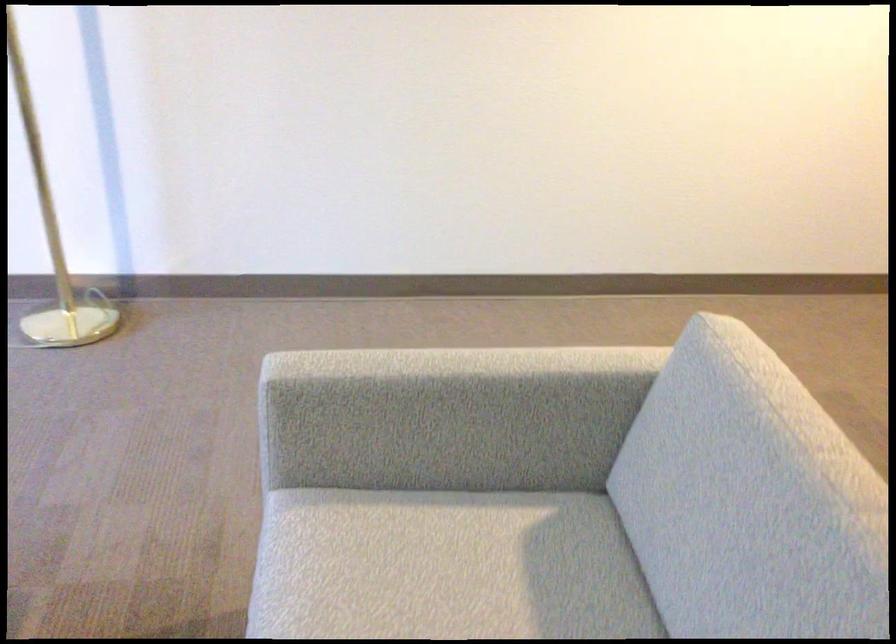
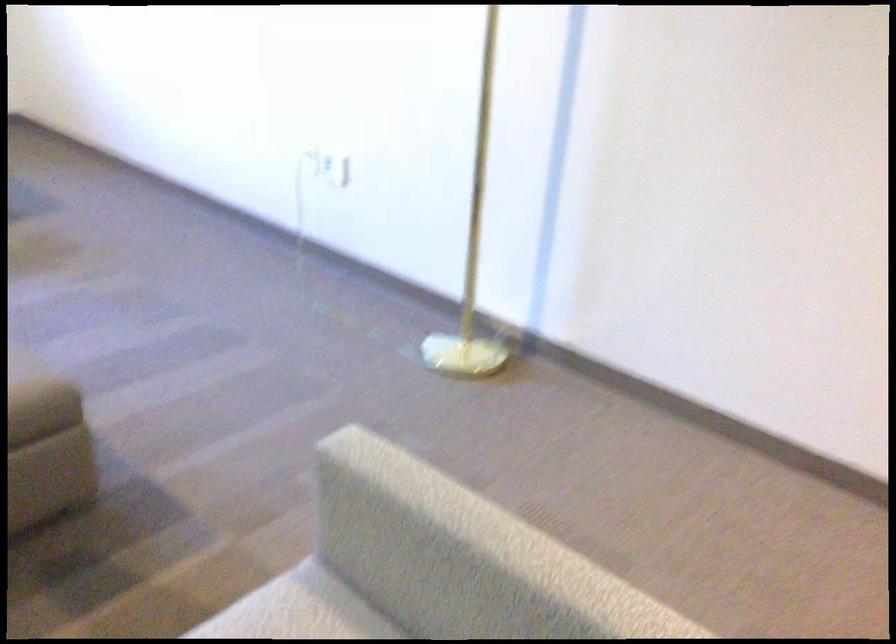
Question: The camera is either moving clockwise (left) or counter-clockwise (right) around the object. The first image is from the beginning of the video and the second image is from the end. Is the camera moving left or right when shooting the video?

Choices:
 (A) Left
 (B) Right

Answer: (B)